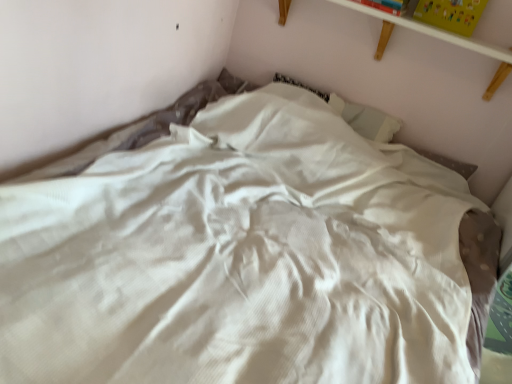
Question: Is white wooden shelf at upper center to the left of yellow matte paper at upper right, which is counted as the 1th paperback book, starting from the right, from the viewer's perspective?

Choices:
 (A) no
 (B) yes

Answer: (B)

Question: Is white wooden shelf at upper center smaller than yellow matte paper at upper right, which is counted as the second paperback book, starting from the left?

Choices:
 (A) no
 (B) yes

Answer: (A)

Question: Is the position of white wooden shelf at upper center more distant than that of yellow matte paper at upper right, which is counted as the second paperback book, starting from the left?

Choices:
 (A) yes
 (B) no

Answer: (B)

Question: Is yellow matte paper at upper right, which is counted as the 1th paperback book, starting from the right, located within white wooden shelf at upper center?

Choices:
 (A) no
 (B) yes

Answer: (A)

Question: Is white wooden shelf at upper center oriented towards yellow matte paper at upper right, which is counted as the 1th paperback book, starting from the right?

Choices:
 (A) yes
 (B) no

Answer: (B)

Question: Is yellow matte paper at upper right, which is counted as the second paperback book, starting from the left, wider or thinner than hardcover book at upper right, the 2th paperback book from the right?

Choices:
 (A) wide
 (B) thin

Answer: (B)

Question: Does point (478, 11) appear closer or farther from the camera than point (353, 1)?

Choices:
 (A) closer
 (B) farther

Answer: (A)

Question: In terms of height, does yellow matte paper at upper right, which is counted as the second paperback book, starting from the left, look taller or shorter compared to hardcover book at upper right, the 1th paperback book in the left-to-right sequence?

Choices:
 (A) short
 (B) tall

Answer: (B)

Question: Considering their positions, is yellow matte paper at upper right, which is counted as the 1th paperback book, starting from the right, located in front of or behind hardcover book at upper right, the 1th paperback book in the left-to-right sequence?

Choices:
 (A) behind
 (B) front

Answer: (B)

Question: From a real-world perspective, is white wooden shelf at upper center physically located above or below hardcover book at upper right, the 2th paperback book from the right?

Choices:
 (A) below
 (B) above

Answer: (A)

Question: Based on their positions, is white wooden shelf at upper center located to the left or right of hardcover book at upper right, the 1th paperback book in the left-to-right sequence?

Choices:
 (A) right
 (B) left

Answer: (A)

Question: Does point (343, 0) appear closer or farther from the camera than point (362, 3)?

Choices:
 (A) closer
 (B) farther

Answer: (B)

Question: From the image's perspective, relative to hardcover book at upper right, the 2th paperback book from the right, is white wooden shelf at upper center above or below?

Choices:
 (A) above
 (B) below

Answer: (B)

Question: Considering the positions of point (282, 9) and point (479, 3), is point (282, 9) closer or farther from the camera than point (479, 3)?

Choices:
 (A) closer
 (B) farther

Answer: (B)

Question: Is white wooden shelf at upper center bigger or smaller than yellow matte paper at upper right, which is counted as the second paperback book, starting from the left?

Choices:
 (A) small
 (B) big

Answer: (B)